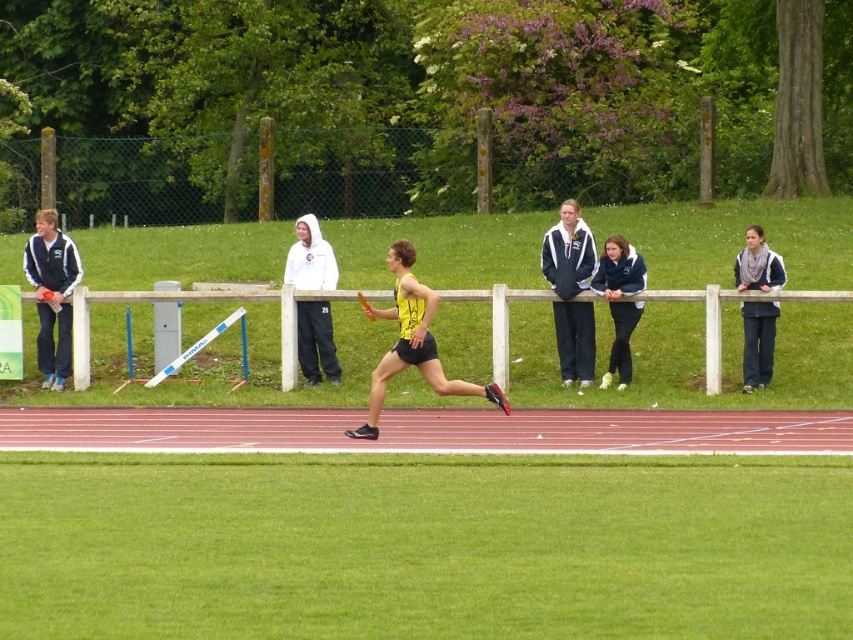
From the picture: You are a photographer trying to capture a group photo of the spectators at the outdoor track and field event. You notice two white fleece items in the background. Which one, the white fleece jacket at center or the white fleece hoodie at upper center, would appear narrower in your photo?

The white fleece jacket at center has a lesser width compared to the white fleece hoodie at upper center, so it would appear narrower in the photo.

You are a photographer trying to capture a clear shot of the runner holding the baton. You notice two spectators wearing green fleece jacket at left and white fleece hoodie at upper center. Which spectator is closer to the camera?

The green fleece jacket at left is positioned under the white fleece hoodie at upper center, which means the white fleece hoodie at upper center is closer to the camera.

You are a photographer positioned at the center of the track. You need to capture a photo of the green fleece jacket at left. Which direction should you move to ensure the jacket is in the frame?

The green fleece jacket at left is located at point [51,294], so you should move to your left to ensure the jacket is in the frame.